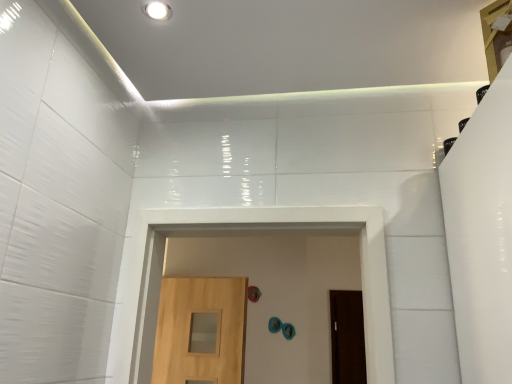
Question: Is light brown wood door at center, the first door from the front, in front of or behind brown matte door at center, the first door in the right-to-left sequence, in the image?

Choices:
 (A) front
 (B) behind

Answer: (A)

Question: Is light brown wood door at center, the first door from the front, wider or thinner than brown matte door at center, the 2th door in the front-to-back sequence?

Choices:
 (A) thin
 (B) wide

Answer: (B)

Question: Based on their relative distances, which object is nearer to the brown matte door at center, acting as the 1th door starting from the back?

Choices:
 (A) white glossy recessed light at upper center
 (B) light brown wood door at center, the first door from the front

Answer: (B)

Question: Estimate the real-world distances between objects in this image. Which object is closer to the white glossy recessed light at upper center?

Choices:
 (A) light brown wood door at center, arranged as the second door when viewed from the back
 (B) brown matte door at center, the 2th door in the front-to-back sequence

Answer: (A)